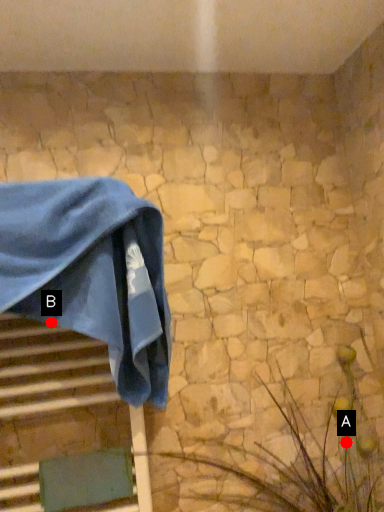
Question: Two points are circled on the image, labeled by A and B beside each circle. Among these points, which one is nearest to the camera?

Choices:
 (A) A is closer
 (B) B is closer

Answer: (B)